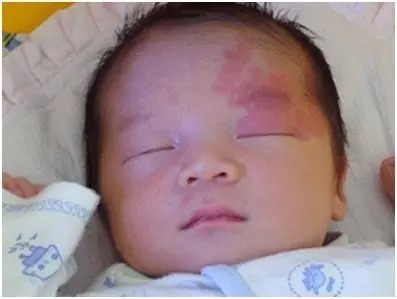
You are a GUI agent. You are given a task and a screenshot of the screen. Output one action in this format:
    pyautogui.click(x=<x>, y=<y>)
    Task: Click on the blanket
    The image size is (397, 299).
    Given the screenshot: What is the action you would take?
    pyautogui.click(x=50, y=134)